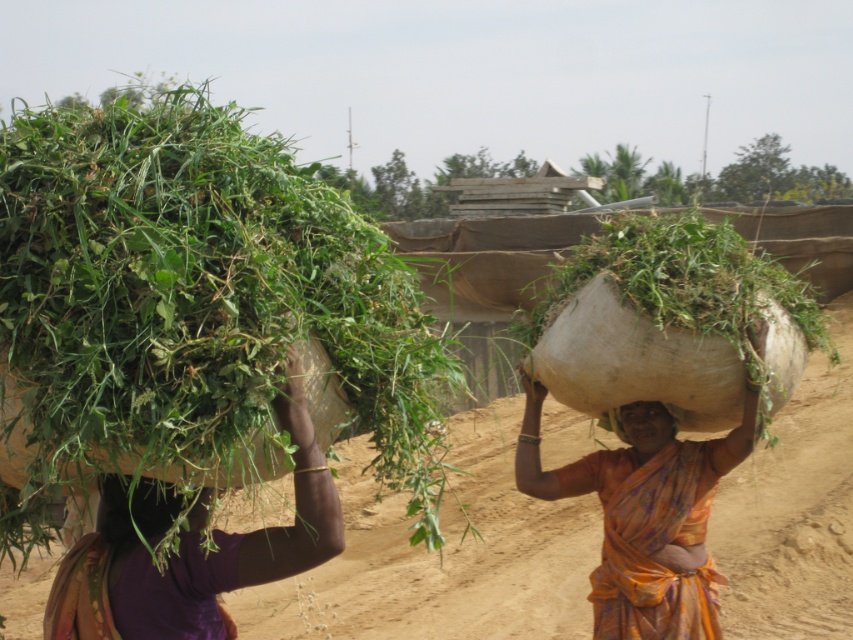
Is point (184, 417) more distant than point (643, 525)?

No, (184, 417) is closer to viewer.

Based on the photo, does green leafy hay at upper left appear over orange floral sari at center?

Indeed, green leafy hay at upper left is positioned over orange floral sari at center.

Is point (415, 540) positioned behind point (630, 534)?

No, it is not.

Locate an element on the screen. This screenshot has height=640, width=853. green leafy hay at upper left is located at coordinates (194, 298).

Does green leafy hay at upper left appear on the right side of matte brown basket at left?

Incorrect, green leafy hay at upper left is not on the right side of matte brown basket at left.

Does green leafy hay at upper left have a greater width compared to matte brown basket at left?

Correct, the width of green leafy hay at upper left exceeds that of matte brown basket at left.

This screenshot has width=853, height=640. Describe the element at coordinates (194, 298) in the screenshot. I see `green leafy hay at upper left` at that location.

Identify the location of green leafy hay at upper left. pyautogui.click(x=194, y=298).

Which of these two, brown woven sack at center or matte brown basket at left, stands shorter?

With less height is matte brown basket at left.

Does point (706, 262) come closer to viewer compared to point (316, 456)?

No, it is behind (316, 456).

Which is in front, point (538, 353) or point (105, 504)?

Point (105, 504) is in front.

The width and height of the screenshot is (853, 640). I want to click on brown woven sack at center, so click(x=671, y=317).